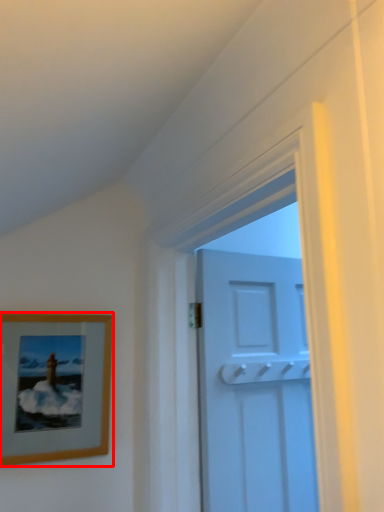
Question: From the image's perspective, where is picture frame (annotated by the red box) located in relation to door in the image?

Choices:
 (A) below
 (B) above

Answer: (B)